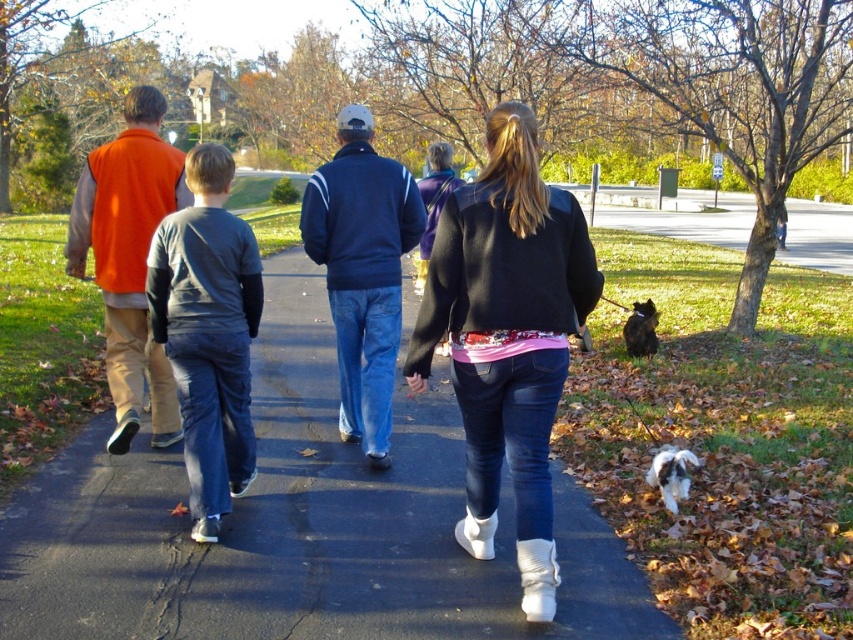
Identify the location of black asphalt pavement at center. (299, 525).

Does black asphalt pavement at center appear on the right side of white fluffy dog at lower right?

No, black asphalt pavement at center is not to the right of white fluffy dog at lower right.

Locate an element on the screen. The image size is (853, 640). black asphalt pavement at center is located at coordinates (299, 525).

Can you confirm if black leather jacket at center is positioned to the left of navy blue jacket at center?

In fact, black leather jacket at center is to the right of navy blue jacket at center.

Can you confirm if black leather jacket at center is smaller than navy blue jacket at center?

No.

Is point (577, 321) positioned in front of point (376, 348)?

That is True.

I want to click on black leather jacket at center, so click(x=508, y=337).

Who is more distant from viewer, (x=260, y=588) or (x=479, y=502)?

The point (x=479, y=502) is behind.

Can you confirm if black asphalt pavement at center is taller than black leather jacket at center?

No, black asphalt pavement at center is not taller than black leather jacket at center.

Find the location of a particular element. The image size is (853, 640). black asphalt pavement at center is located at coordinates (299, 525).

Find the location of a particular element. black asphalt pavement at center is located at coordinates point(299,525).